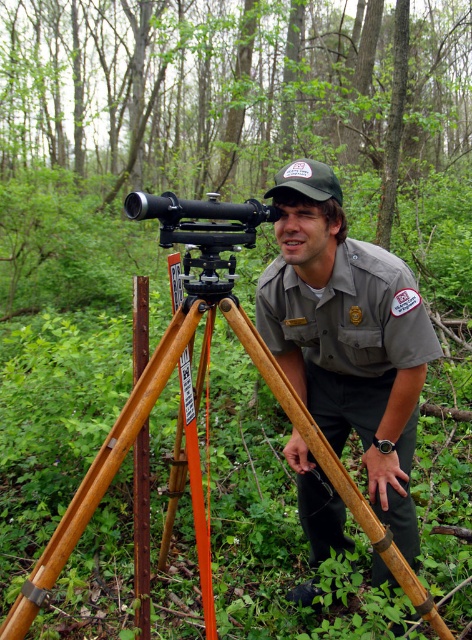
You are a park visitor and see the gray uniform at center and the rusty metal pole at center. Which object is positioned more to the right side?

The gray uniform at center is positioned more to the right side than the rusty metal pole at center.

You are a photographer standing 2 meters away from the camera. You want to take a photo of the gray uniform at center. If the camera has a focal length of 50mm and the subject needs to fill 50 percent of the frame height, will the current distance work? Assume the sensor height is 24mm.

The gray uniform at center is 1.66 meters from the camera. Since the photographer is standing 2 meters away from the camera, the total distance between the photographer and the gray uniform at center would be 3.66 meters. To determine if the subject fills 50 percent of the frame height, we calculate the required distance using the sensor height formula. The sensor height is 24mm, so 50 percent would be 12mm. Using the formula distance_sensor_distance_object_height_sensor_height, the required distance would